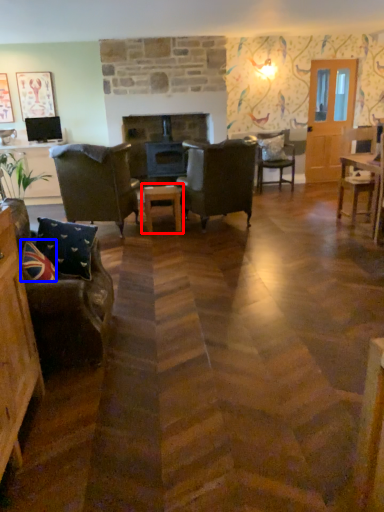
Question: Among these objects, which one is nearest to the camera, table (highlighted by a red box) or pillow (highlighted by a blue box)?

Choices:
 (A) table
 (B) pillow

Answer: (B)